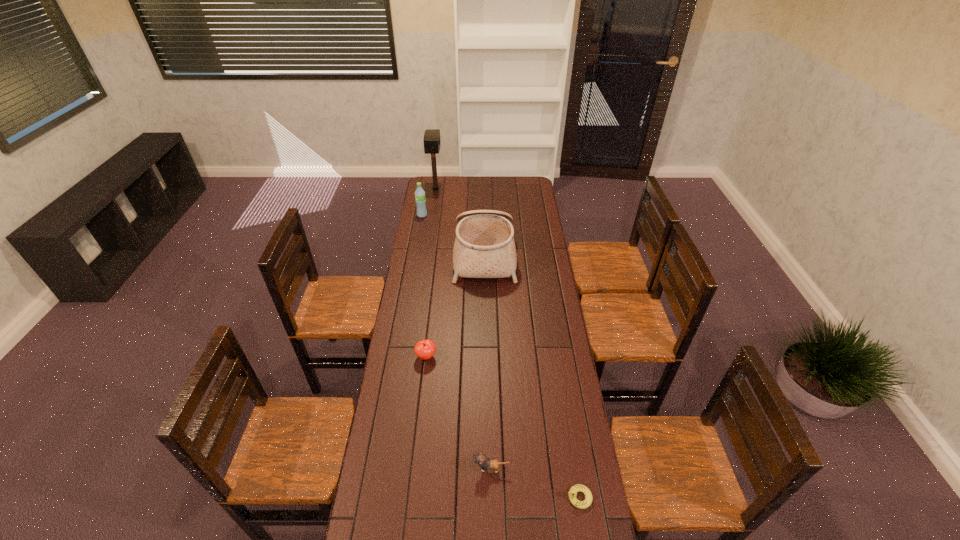
Find the location of a particular element. The height and width of the screenshot is (540, 960). free space at the far left corner of the desktop is located at coordinates (430, 195).

Where is `vacant space at the far right corner of the desktop`? vacant space at the far right corner of the desktop is located at coordinates (516, 191).

Identify the location of free point between the apple and the kitten. The height and width of the screenshot is (540, 960). (459, 413).

Locate an element on the screen. This screenshot has height=540, width=960. free space between the nearest object and the farthest object is located at coordinates (508, 343).

Locate an element on the screen. This screenshot has width=960, height=540. empty space between the duckling and the third nearest object is located at coordinates (503, 427).

I want to click on free space between the duckling and the apple, so click(503, 427).

This screenshot has width=960, height=540. Find the location of `vacant space in between the apple and the mallet`. vacant space in between the apple and the mallet is located at coordinates (431, 273).

I want to click on vacant area that lies between the fourth farthest object and the basket, so click(455, 306).

Find the location of a particular element. Image resolution: width=960 pixels, height=540 pixels. empty location between the shortest object and the third nearest object is located at coordinates (503, 427).

In order to click on vacant area between the fourth shortest object and the third farthest object in this screenshot , I will do `click(453, 235)`.